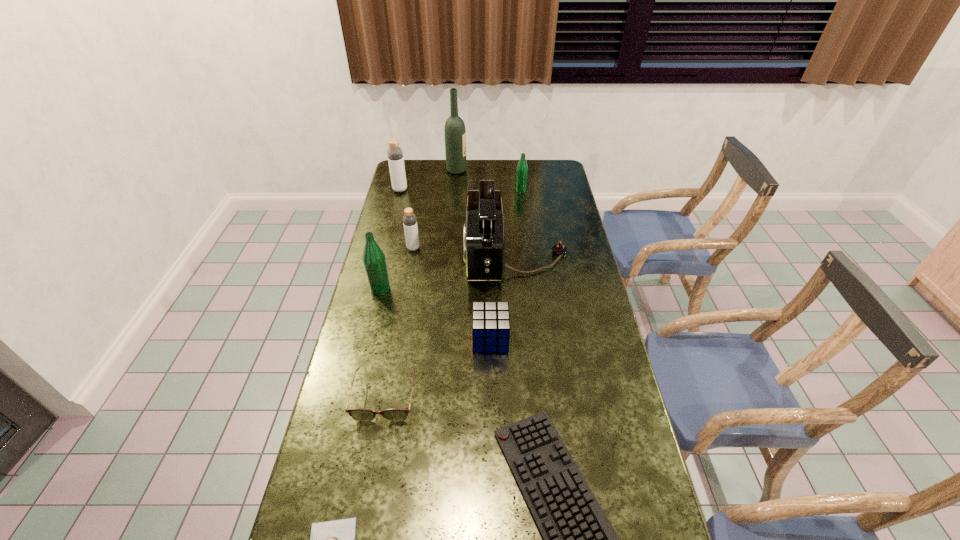
This screenshot has height=540, width=960. Find the location of `the second nearest bottle`. the second nearest bottle is located at coordinates (409, 219).

Find the location of a particular element. red cube is located at coordinates (491, 320).

Identify the location of the fourth shortest object. The width and height of the screenshot is (960, 540). (491, 320).

Where is `brown spectacles`? The image size is (960, 540). brown spectacles is located at coordinates (395, 414).

You are a GUI agent. You are given a task and a screenshot of the screen. Output one action in this format:
    pyautogui.click(x=<x>, y=<y>)
    Task: Click on the eighth tallest object
    This screenshot has height=540, width=960.
    Given the screenshot: What is the action you would take?
    pyautogui.click(x=395, y=414)

Where is `blank space located on the labeled side of the farthest object`? blank space located on the labeled side of the farthest object is located at coordinates (513, 171).

This screenshot has width=960, height=540. I want to click on vacant space located 0.330m on the front-facing side of the radio receiver, so [377, 255].

Image resolution: width=960 pixels, height=540 pixels. Identify the location of free space located 0.150m on the front-facing side of the radio receiver. (425, 255).

In order to click on vacant area located on the front-facing side of the radio receiver in this screenshot , I will do `click(425, 255)`.

Locate an element on the screen. The width and height of the screenshot is (960, 540). vacant region located on the right of the farther gray bottle is located at coordinates (419, 190).